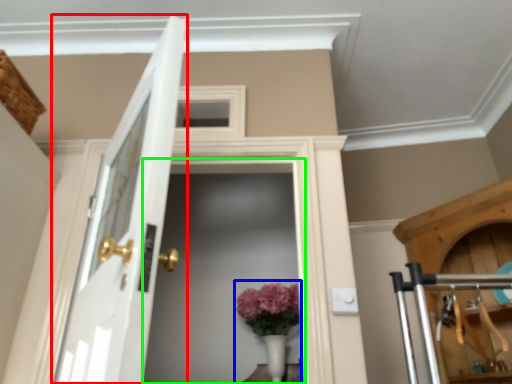
Question: Which object is the closest to the door (highlighted by a red box)? Choose among these: floral arrangement (highlighted by a blue box) or screen door (highlighted by a green box).

Choices:
 (A) floral arrangement
 (B) screen door

Answer: (A)